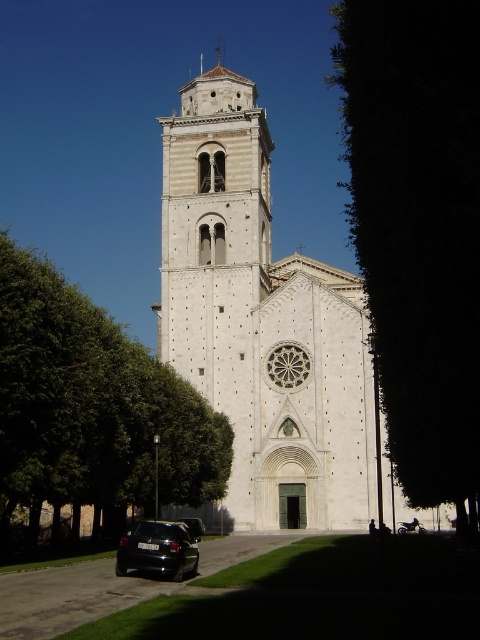
Does white stone church at center appear on the left side of black matte car at lower left?

Incorrect, white stone church at center is not on the left side of black matte car at lower left.

Is the position of white stone church at center more distant than that of black matte car at lower left?

Yes, it is.

Describe the element at coordinates (261, 323) in the screenshot. I see `white stone church at center` at that location.

This screenshot has width=480, height=640. Find the location of `white stone church at center`. white stone church at center is located at coordinates (261, 323).

Between green leafy tree at right and green leafy tree at left, which one has more height?

green leafy tree at right

Based on the photo, who is lower down, green leafy tree at right or green leafy tree at left?

green leafy tree at left is lower down.

What do you see at coordinates (418, 227) in the screenshot? The image size is (480, 640). I see `green leafy tree at right` at bounding box center [418, 227].

The width and height of the screenshot is (480, 640). In order to click on green leafy tree at right in this screenshot , I will do `click(418, 227)`.

Between green leafy tree at right and black matte car at lower left, which one appears on the left side from the viewer's perspective?

black matte car at lower left is more to the left.

Can you confirm if green leafy tree at right is bigger than black matte car at lower left?

Correct, green leafy tree at right is larger in size than black matte car at lower left.

I want to click on green leafy tree at right, so click(x=418, y=227).